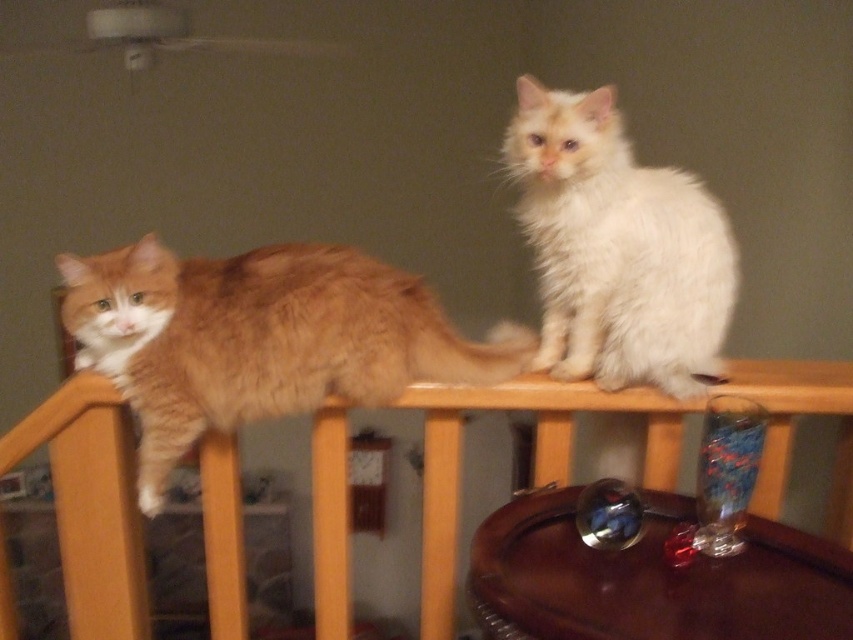
You are taking a photo of the two cats on the chair. The cats are at the points labeled as point (816, 362) and point (548, 353). Which cat is closer to the camera?

Point (816, 362) is further to the camera than point (548, 353). Therefore, the cat at point (548, 353) is closer to the camera.

You are a photographer setting up for a cat photo shoot. You need to position a small red prop between the two cats on the chair. Given that the orange fluffy cat at upper left is taller than the white fluffy cat at upper right, where should you place the prop so that both cats can easily see it?

Place the small red prop between the orange fluffy cat at upper left and the white fluffy cat at upper right, closer to the white fluffy cat at upper right since the orange fluffy cat at upper left is taller and can still see it over the shorter white fluffy cat at upper right.